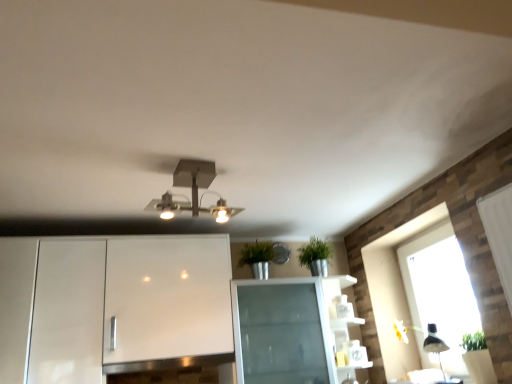
Question: In terms of size, does black matte lamp at lower right appear bigger or smaller than metallic square light fixture at center?

Choices:
 (A) small
 (B) big

Answer: (A)

Question: From a real-world perspective, is black matte lamp at lower right above or below metallic square light fixture at center?

Choices:
 (A) below
 (B) above

Answer: (A)

Question: Estimate the real-world distances between objects in this image. Which object is closer to the metallic square light fixture at center?

Choices:
 (A) black matte lamp at lower right
 (B) transparent glass window at right

Answer: (B)

Question: Based on their relative distances, which object is farther from the black matte lamp at lower right?

Choices:
 (A) transparent glass window at right
 (B) metallic square light fixture at center

Answer: (B)